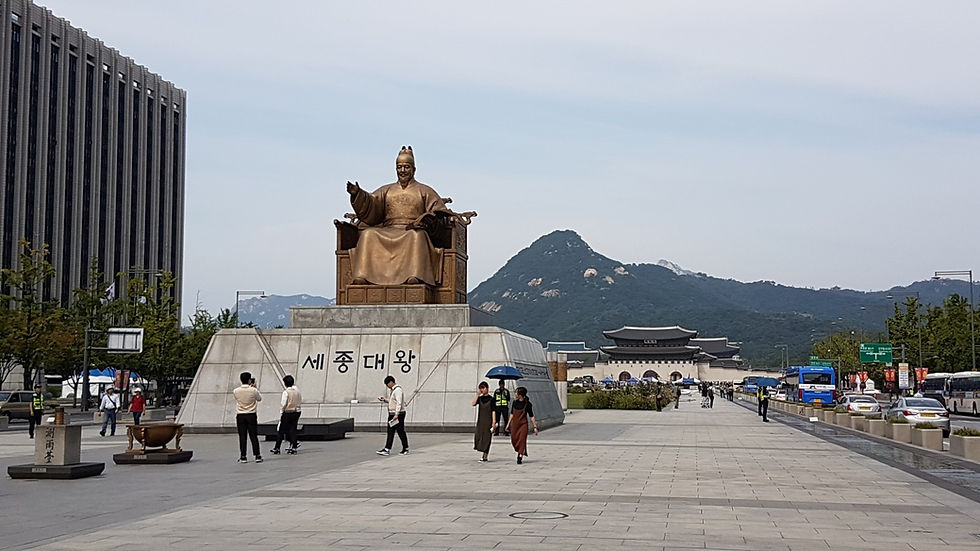
Locate an element on the screen. This screenshot has height=551, width=980. statue is located at coordinates (411, 222).